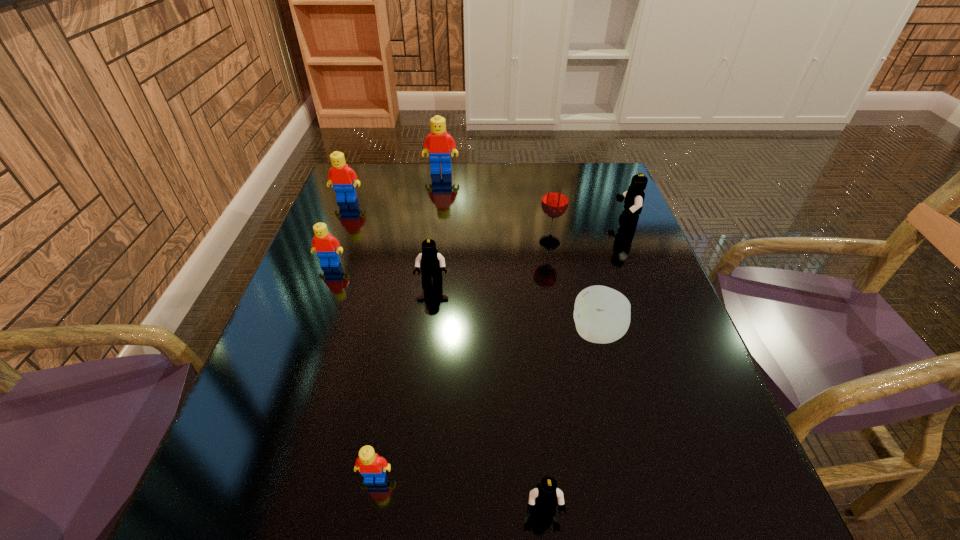
Where is `the sixth closest Lego to the rightmost black Lego`? the sixth closest Lego to the rightmost black Lego is located at coordinates (x=370, y=465).

Where is `the closest Lego to the biggest black Lego`? the closest Lego to the biggest black Lego is located at coordinates (431, 263).

The width and height of the screenshot is (960, 540). Identify the location of the closest red Lego to the farthest object. (343, 178).

Image resolution: width=960 pixels, height=540 pixels. In order to click on red Lego object that ranks as the fourth closest to the second Lego from right to left in this screenshot , I will do `click(439, 143)`.

At what (x,y) coordinates should I click in order to perform the action: click on the second closest black Lego relative to the fifth farthest object. Please return your answer as a coordinate pair (x, y). This screenshot has width=960, height=540. Looking at the image, I should click on (546, 495).

Identify the location of the second closest black Lego relative to the nearest black Lego. This screenshot has width=960, height=540. (634, 197).

Identify the location of free space that satisfies the following two spatial constraints: 1. on the face of the fifth nearest object; 2. on the left side of the seventh farthest object. coord(305,333).

Find the location of `free region that satisfies the following two spatial constraints: 1. on the face of the apple; 2. on the left side of the fifth farthest object`. free region that satisfies the following two spatial constraints: 1. on the face of the apple; 2. on the left side of the fifth farthest object is located at coordinates (305, 333).